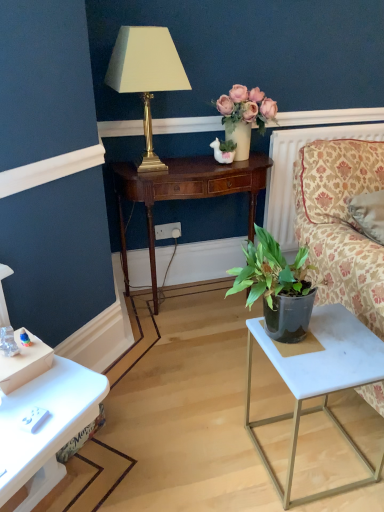
Question: Is white plastic power outlet at center wider than matte gold lamp at upper center?

Choices:
 (A) no
 (B) yes

Answer: (A)

Question: Are white plastic power outlet at center and matte gold lamp at upper center far apart?

Choices:
 (A) yes
 (B) no

Answer: (B)

Question: From a real-world perspective, is white plastic power outlet at center below matte gold lamp at upper center?

Choices:
 (A) no
 (B) yes

Answer: (B)

Question: From the image's perspective, does white plastic power outlet at center appear lower than matte gold lamp at upper center?

Choices:
 (A) yes
 (B) no

Answer: (A)

Question: Considering the relative positions of white plastic power outlet at center and matte gold lamp at upper center in the image provided, is white plastic power outlet at center to the right of matte gold lamp at upper center from the viewer's perspective?

Choices:
 (A) no
 (B) yes

Answer: (B)

Question: Considering the relative positions of white plastic power outlet at center and matte gold lamp at upper center in the image provided, is white plastic power outlet at center in front of matte gold lamp at upper center?

Choices:
 (A) yes
 (B) no

Answer: (B)

Question: Is white textured radiator at upper right to the right of matte gold lamp at upper center from the viewer's perspective?

Choices:
 (A) no
 (B) yes

Answer: (B)

Question: Considering the relative sizes of white textured radiator at upper right and matte gold lamp at upper center in the image provided, is white textured radiator at upper right wider than matte gold lamp at upper center?

Choices:
 (A) yes
 (B) no

Answer: (B)

Question: Considering the relative sizes of white textured radiator at upper right and matte gold lamp at upper center in the image provided, is white textured radiator at upper right taller than matte gold lamp at upper center?

Choices:
 (A) no
 (B) yes

Answer: (B)

Question: From a real-world perspective, is white textured radiator at upper right beneath matte gold lamp at upper center?

Choices:
 (A) no
 (B) yes

Answer: (B)

Question: Can you confirm if white textured radiator at upper right is positioned to the left of matte gold lamp at upper center?

Choices:
 (A) no
 (B) yes

Answer: (A)

Question: Considering the relative positions of white textured radiator at upper right and matte gold lamp at upper center in the image provided, is white textured radiator at upper right in front of matte gold lamp at upper center?

Choices:
 (A) yes
 (B) no

Answer: (B)

Question: From a real-world perspective, is matte cream vase at upper center beneath floral-patterned fabric couch at right?

Choices:
 (A) no
 (B) yes

Answer: (A)